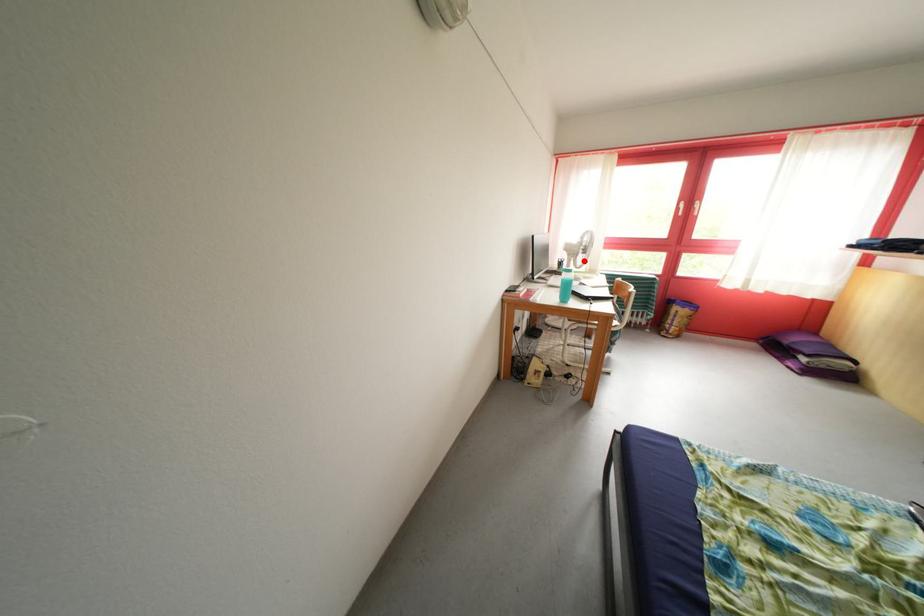
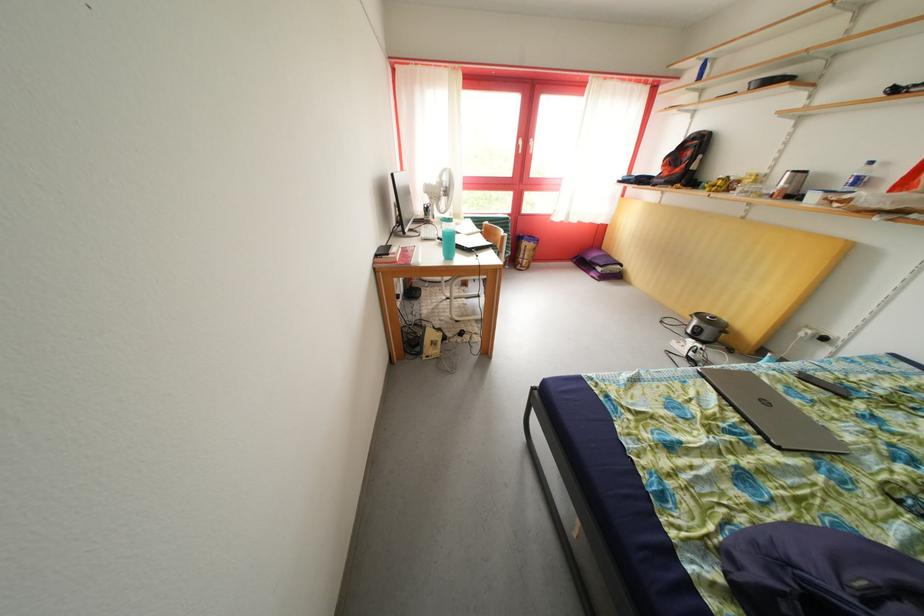
Question: I am providing you with two images of the same scene from different viewpoints. Image1 has a red point marked. In image2, the corresponding 3D location appears at what relative position? Reply with the corresponding letter.

Choices:
 (A) Closer
 (B) Farther

Answer: (B)